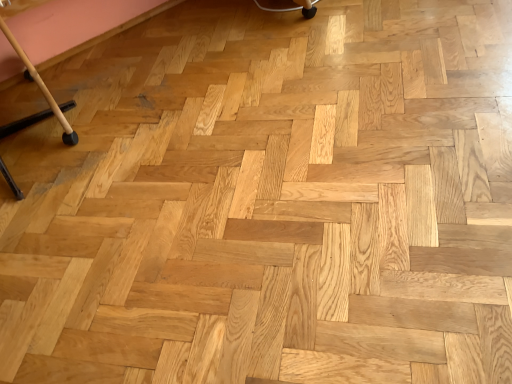
Find the location of `vacant area in front of wooden cane at left`. vacant area in front of wooden cane at left is located at coordinates (78, 232).